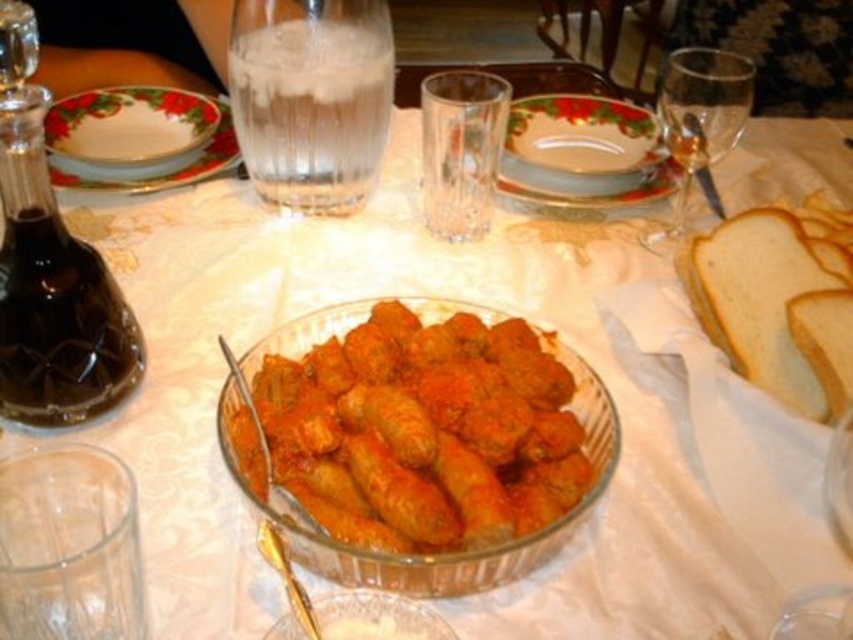
Is golden brown breaded rolls at center below transparent glass wine glass at upper right?

Correct, golden brown breaded rolls at center is located below transparent glass wine glass at upper right.

Is golden brown breaded rolls at center in front of transparent glass wine glass at upper right?

Yes, golden brown breaded rolls at center is in front of transparent glass wine glass at upper right.

Is point (503, 493) more distant than point (705, 100)?

That is False.

This screenshot has width=853, height=640. Find the location of `golden brown breaded rolls at center`. golden brown breaded rolls at center is located at coordinates (419, 432).

Which of these two, golden brown breaded rolls at center or decorative ceramic plate at upper left, stands taller?

With more height is golden brown breaded rolls at center.

Find the location of a particular element. This screenshot has width=853, height=640. golden brown breaded rolls at center is located at coordinates (419, 432).

Is point (294, 364) positioned behind point (195, 125)?

No, (294, 364) is in front of (195, 125).

This screenshot has height=640, width=853. Identify the location of golden brown breaded rolls at center. (419, 432).

Between dark glass bottle at left and decorative ceramic plate at upper left, which one has more height?

With more height is dark glass bottle at left.

In the scene shown: Who is higher up, dark glass bottle at left or decorative ceramic plate at upper left?

decorative ceramic plate at upper left is above.

What do you see at coordinates (53, 291) in the screenshot? This screenshot has height=640, width=853. I see `dark glass bottle at left` at bounding box center [53, 291].

Identify the location of dark glass bottle at left. The height and width of the screenshot is (640, 853). (53, 291).